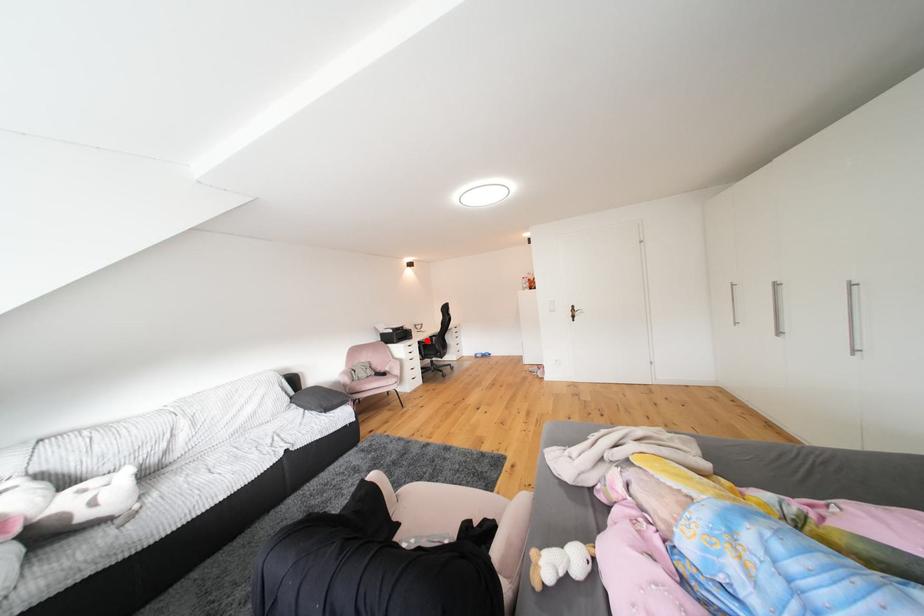
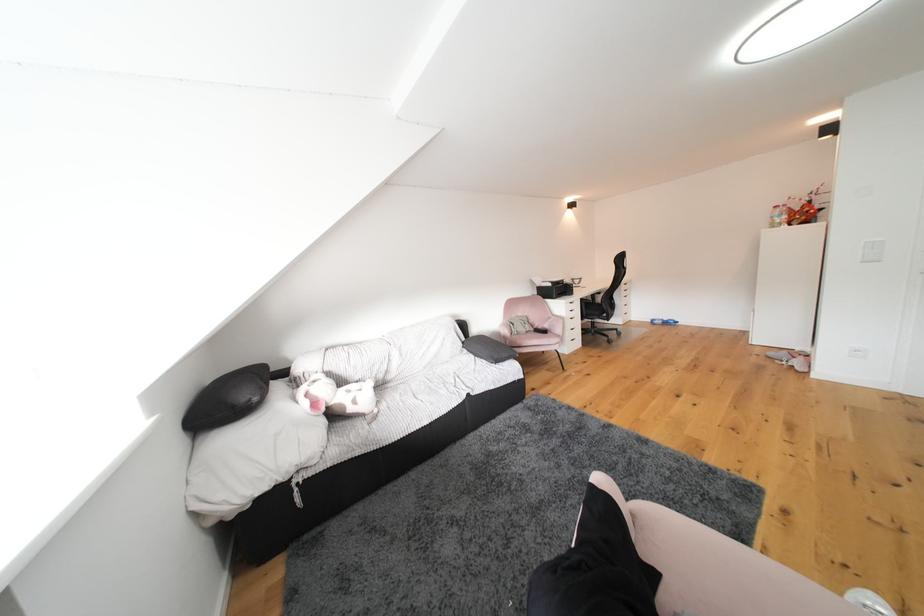
Locate, in the second image, the point that corresponds to the highlighted location in the first image.

(590, 297)